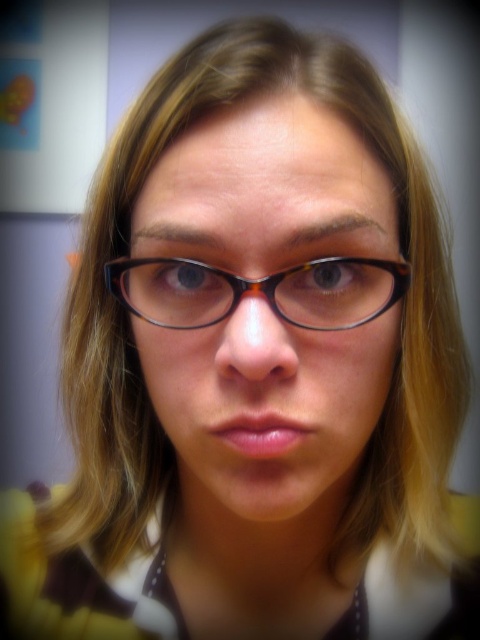
Is black tortoiseshell glasses at center taller than tortoiseshell frame glasses at center?

Yes, black tortoiseshell glasses at center is taller than tortoiseshell frame glasses at center.

Between black tortoiseshell glasses at center and tortoiseshell frame glasses at center, which one is positioned higher?

tortoiseshell frame glasses at center is higher up.

Is point (241, 177) positioned in front of point (156, 285)?

Yes, point (241, 177) is in front of point (156, 285).

You are a GUI agent. You are given a task and a screenshot of the screen. Output one action in this format:
    pyautogui.click(x=<x>, y=<y>)
    Task: Click on the black tortoiseshell glasses at center
    The height and width of the screenshot is (640, 480).
    Given the screenshot: What is the action you would take?
    pyautogui.click(x=266, y=410)